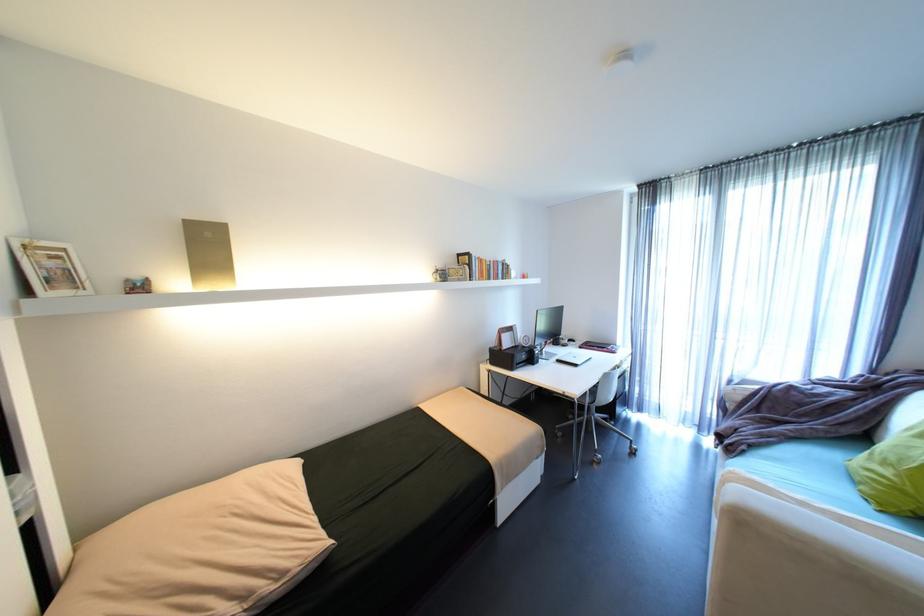
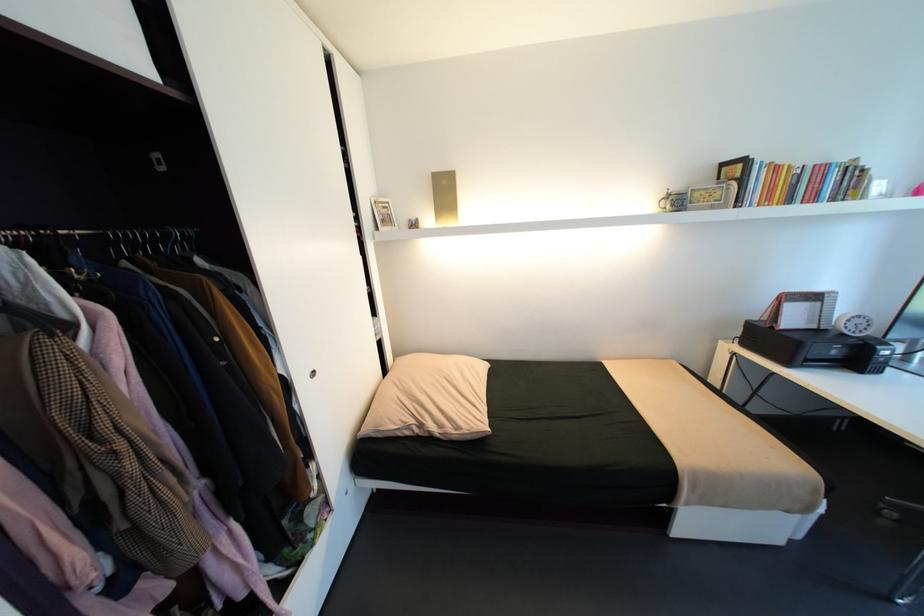
Locate, in the second image, the point that corresponds to the point at 500,262 in the first image.

(821, 166)